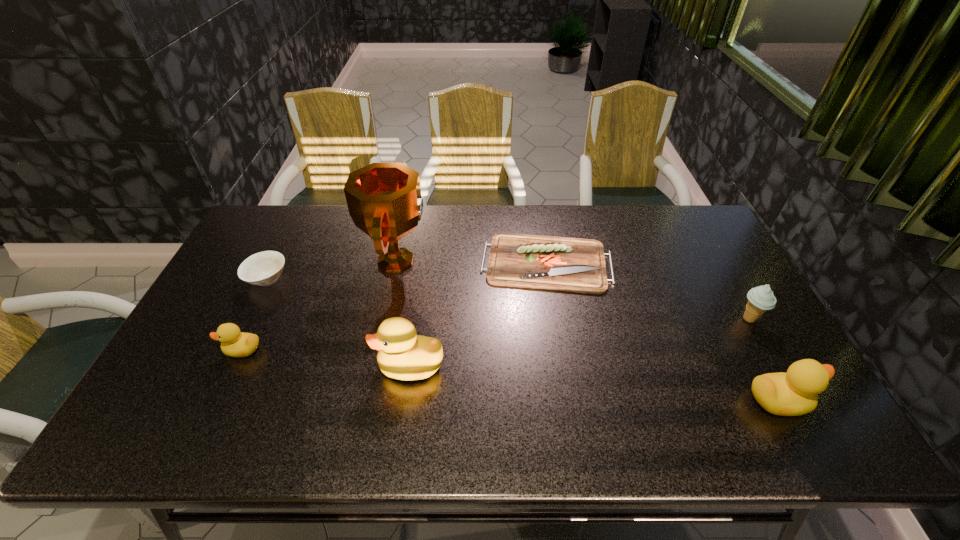
Locate an element on the screen. The image size is (960, 540). award at the far edge is located at coordinates (384, 200).

You are a GUI agent. You are given a task and a screenshot of the screen. Output one action in this format:
    pyautogui.click(x=<x>, y=<y>)
    Task: Click on the duckling at the left edge
    Image resolution: width=960 pixels, height=540 pixels.
    Given the screenshot: What is the action you would take?
    pyautogui.click(x=234, y=343)

Where is `bowl that is at the left edge`? bowl that is at the left edge is located at coordinates (263, 268).

The image size is (960, 540). Find the location of `duckling at the right edge`. duckling at the right edge is located at coordinates (794, 393).

Locate an element on the screen. The width and height of the screenshot is (960, 540). icecream that is positioned at the right edge is located at coordinates (760, 299).

Where is `object located at the near right corner`? The width and height of the screenshot is (960, 540). object located at the near right corner is located at coordinates (794, 393).

Identify the location of free region at the far edge of the desktop. (592, 225).

Identify the location of vacant space at the near edge of the desktop. This screenshot has width=960, height=540. (425, 401).

Image resolution: width=960 pixels, height=540 pixels. I want to click on free space at the left edge, so click(178, 361).

You are a GUI agent. You are given a task and a screenshot of the screen. Output one action in this format:
    pyautogui.click(x=<x>, y=<y>)
    Task: Click on the vacant area at the right edge of the desktop
    
    Given the screenshot: What is the action you would take?
    pyautogui.click(x=742, y=345)